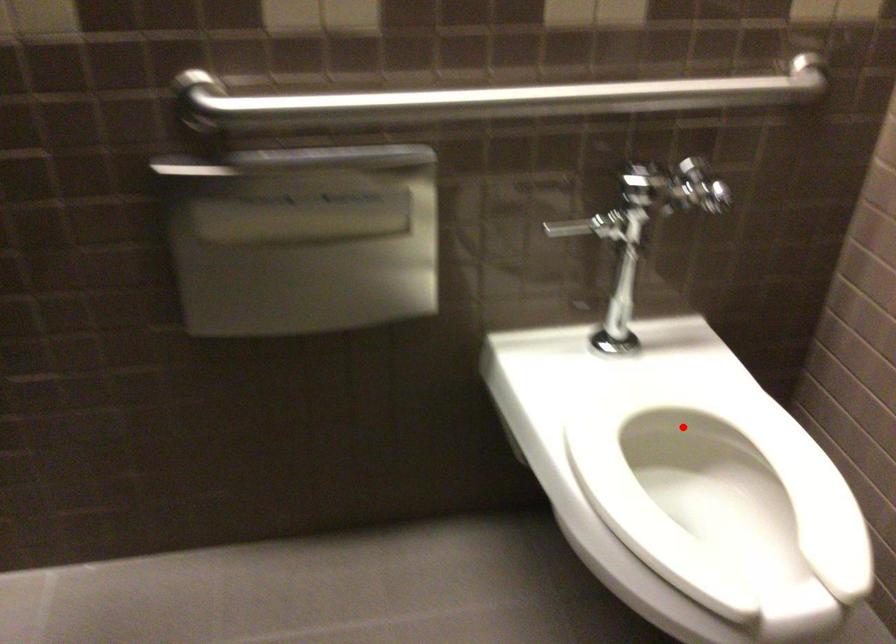
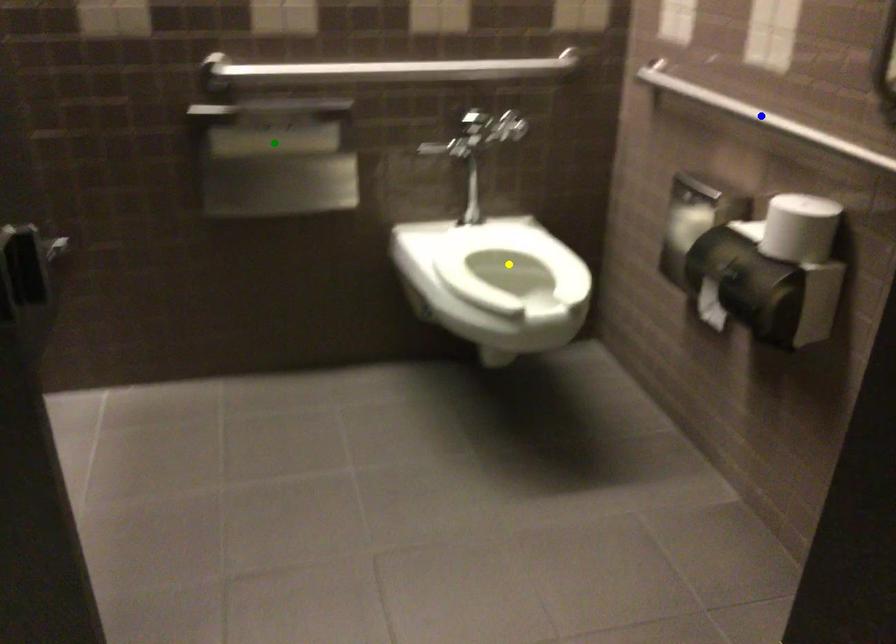
Question: I am providing you with two images of the same scene from different viewpoints. A red point is marked on the first image. You are given multiple points on the second image. Which spot in image 2 lines up with the point in image 1?

Choices:
 (A) green point
 (B) yellow point
 (C) blue point

Answer: (B)